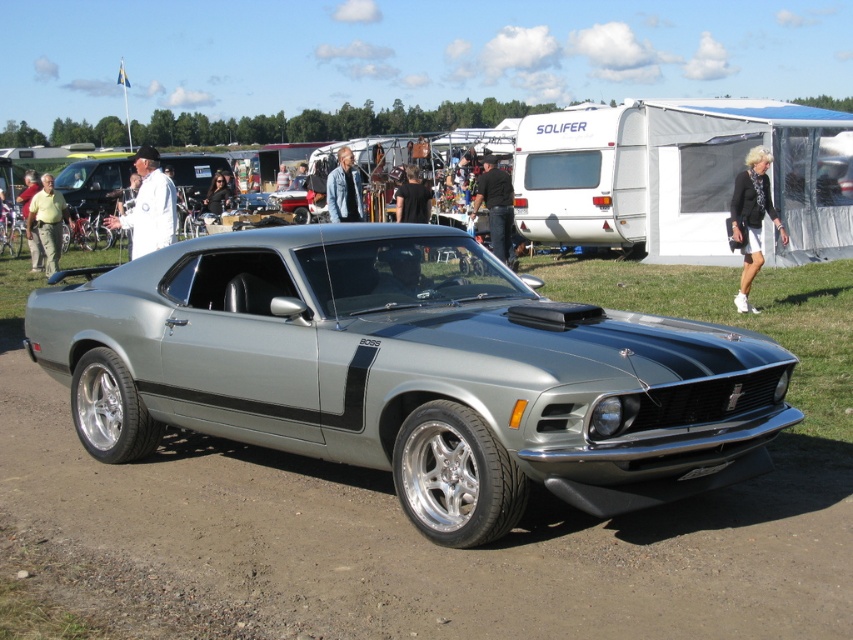
Question: Which object is positioned closest to the white shorts at center?

Choices:
 (A) black cotton shirt at center
 (B) denim jacket at center

Answer: (A)

Question: Which of the following is the farthest from the observer?

Choices:
 (A) white shorts at center
 (B) light brown leather jacket at left
 (C) denim jacket at center

Answer: (B)

Question: Is satin silver muscle car at center further to camera compared to light brown leather jacket at left?

Choices:
 (A) no
 (B) yes

Answer: (A)

Question: Is white cloth at center to the left of black cotton shirt at center from the viewer's perspective?

Choices:
 (A) yes
 (B) no

Answer: (A)

Question: Is the position of light brown leather jacket at left more distant than that of denim jacket at center?

Choices:
 (A) yes
 (B) no

Answer: (A)

Question: Which point is farther from the camera taking this photo?

Choices:
 (A) (740, 189)
 (B) (219, 208)
 (C) (346, 164)
 (D) (64, 212)

Answer: (B)